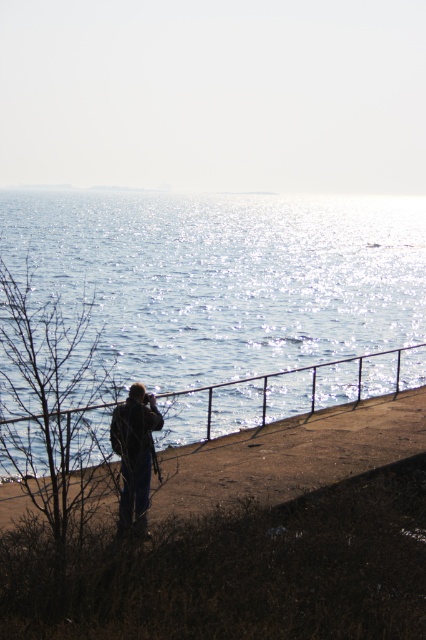
Can you confirm if glistening blue water at center is positioned below dark blue jeans at lower left?

Actually, glistening blue water at center is above dark blue jeans at lower left.

Can you confirm if glistening blue water at center is wider than dark blue jeans at lower left?

Yes, glistening blue water at center is wider than dark blue jeans at lower left.

Describe the element at coordinates (224, 276) in the screenshot. I see `glistening blue water at center` at that location.

Identify the location of glistening blue water at center. (224, 276).

Identify the location of brown dirt at lower left. (290, 456).

Between point (241, 493) and point (141, 484), which one is positioned behind?

The point (241, 493) is more distant.

Image resolution: width=426 pixels, height=640 pixels. I want to click on brown dirt at lower left, so click(290, 456).

You are a GUI agent. You are given a task and a screenshot of the screen. Output one action in this format:
    pyautogui.click(x=<x>, y=<y>)
    Task: Click on the brown dirt at lower left
    The image size is (426, 640).
    Given the screenshot: What is the action you would take?
    pyautogui.click(x=290, y=456)

Which is above, glistening blue water at center or brown dirt at lower left?

glistening blue water at center is higher up.

Can you confirm if glistening blue water at center is positioned above brown dirt at lower left?

Indeed, glistening blue water at center is positioned over brown dirt at lower left.

Who is more distant from viewer, (161, 280) or (164, 486)?

Positioned behind is point (161, 280).

Find the location of a particular element. glistening blue water at center is located at coordinates (224, 276).